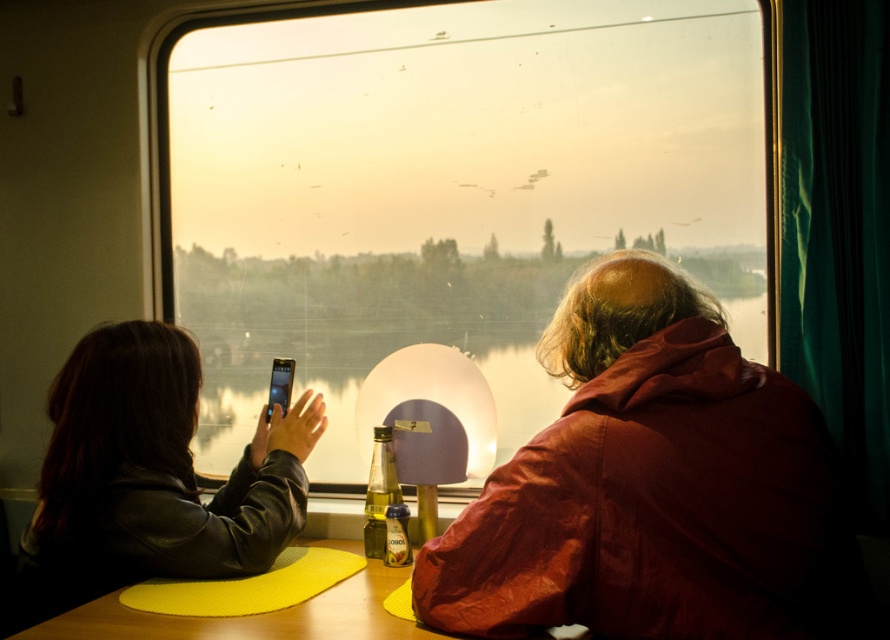
Question: Is transparent glass train window at center to the right of translucent glass bottle at center from the viewer's perspective?

Choices:
 (A) no
 (B) yes

Answer: (B)

Question: Considering the relative positions of transparent glass train window at center and yellow rubber mat at lower center in the image provided, where is transparent glass train window at center located with respect to yellow rubber mat at lower center?

Choices:
 (A) above
 (B) below

Answer: (A)

Question: Can you confirm if transparent glass train window at center is wider than leather jacket at left?

Choices:
 (A) no
 (B) yes

Answer: (B)

Question: Which object is positioned farthest from the leather jacket at left?

Choices:
 (A) matte red jacket at center
 (B) translucent glass bottle at center
 (C) transparent glass train window at center

Answer: (C)

Question: Which of the following is the farthest from the observer?

Choices:
 (A) leather jacket at left
 (B) transparent glass water at center
 (C) translucent glass bottle at center

Answer: (B)

Question: Which object is the farthest from the transparent glass train window at center?

Choices:
 (A) leather jacket at left
 (B) matte red jacket at center

Answer: (B)